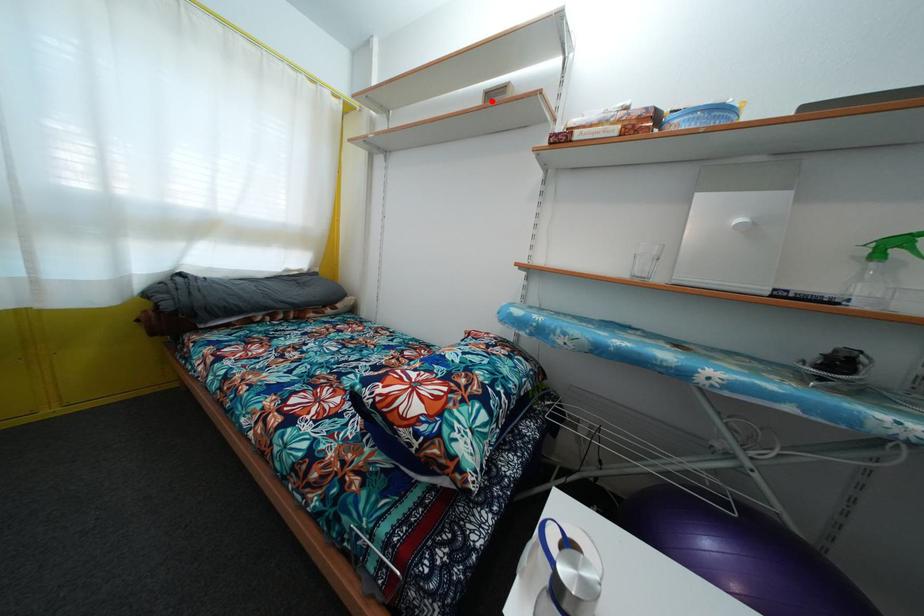
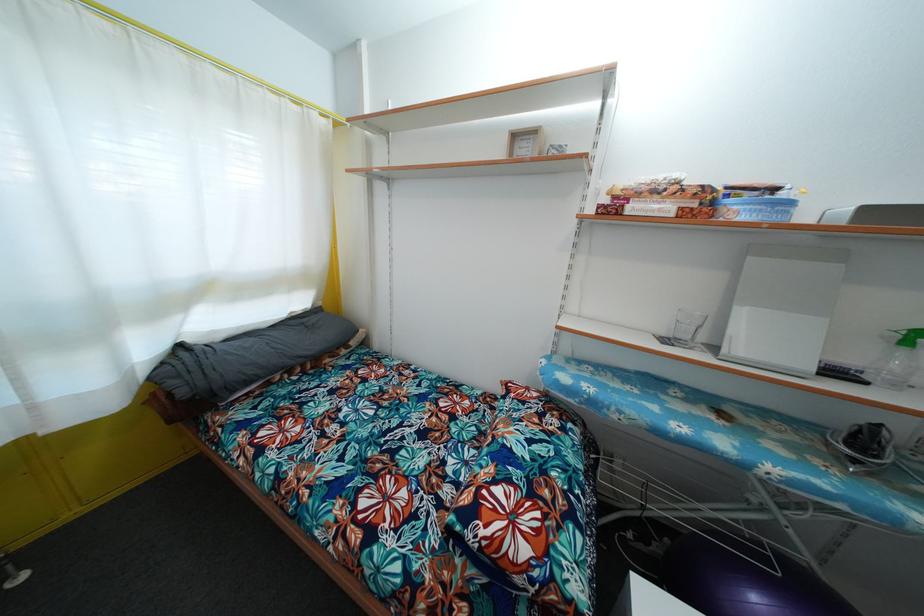
Locate, in the second image, the point that corresponds to the highlighted location in the first image.

(518, 143)